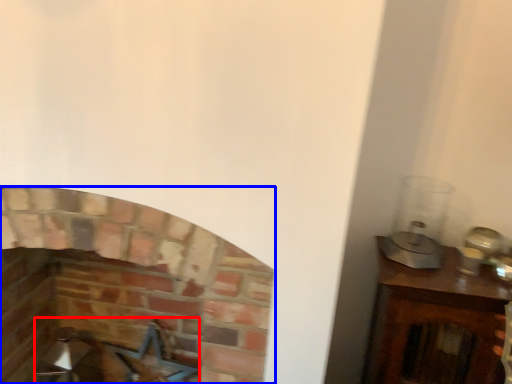
Question: Which of the following is the closest to the observer, swivel chair (highlighted by a red box) or fireplace (highlighted by a blue box)?

Choices:
 (A) swivel chair
 (B) fireplace

Answer: (B)